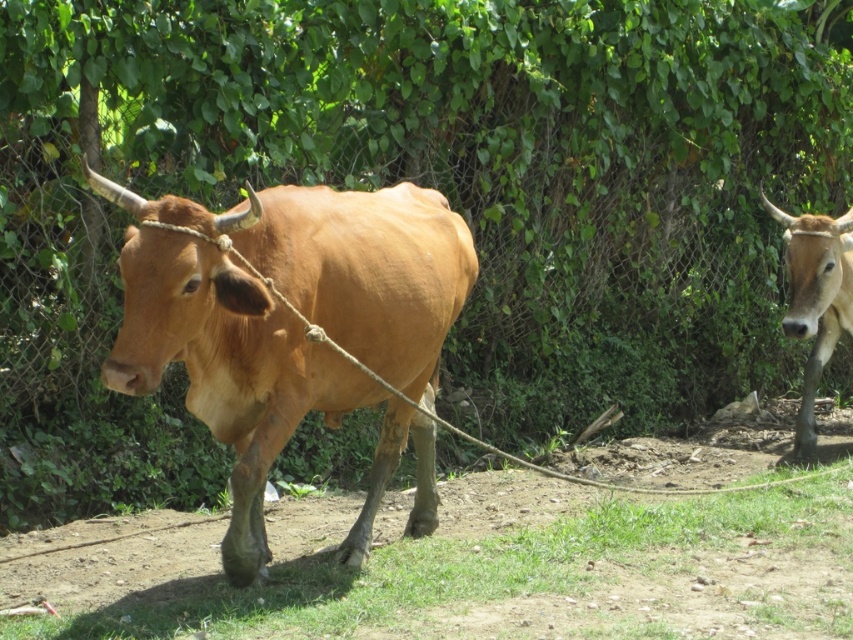
You are a farmer checking the field. You see the green grass at lower center and the brown glossy cow at right. Which one has a larger width?

The green grass at lower center might be wider than brown glossy cow at right according to the description.

You are a farmer checking the field. You see the green grass at lower center and the shiny brown bull at center. Which one is wider?

The green grass at lower center might be wider than shiny brown bull at center.

You are a farmer checking the field. You see the shiny brown bull at center and the brown glossy cow at right. Which one is closer to you?

The shiny brown bull at center is closer to you because it is positioned under the brown glossy cow at right, meaning it is in front of the cow and thus nearer to your viewpoint.